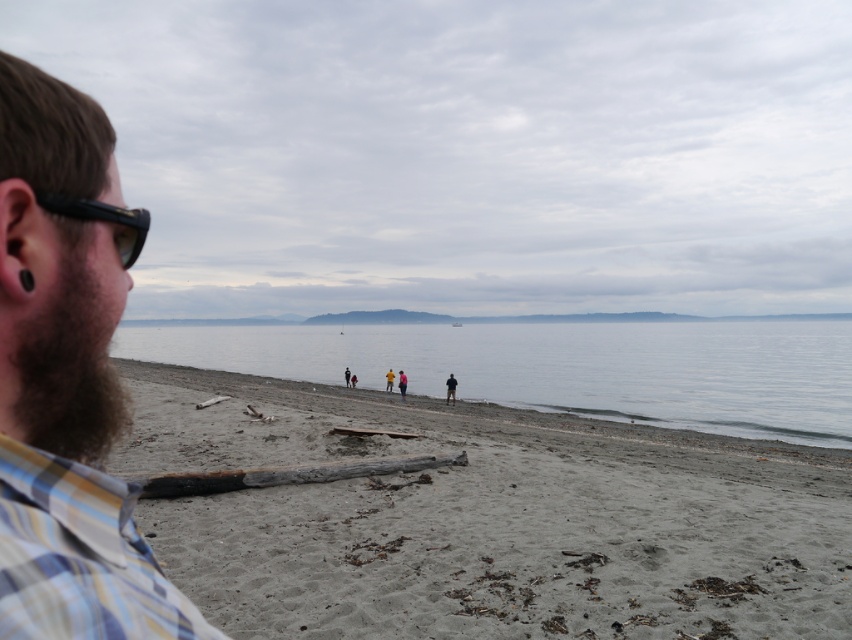
In the scene shown: Who is positioned more to the left, gray sandy beach at center or clear water at center?

gray sandy beach at center is more to the left.

Does point (602, 429) come behind point (749, 381)?

That is False.

Does point (304, 492) lie in front of point (752, 392)?

Yes, it is in front of point (752, 392).

This screenshot has height=640, width=852. I want to click on gray sandy beach at center, so click(x=482, y=518).

Does point (697, 344) lie in front of point (400, 381)?

No.

Is point (629, 332) positioned after point (398, 384)?

Yes.

This screenshot has height=640, width=852. In order to click on clear water at center in this screenshot , I will do (562, 365).

Does gray sandy beach at center have a smaller size compared to pink fabric person at center?

Actually, gray sandy beach at center might be larger than pink fabric person at center.

What do you see at coordinates (482, 518) in the screenshot?
I see `gray sandy beach at center` at bounding box center [482, 518].

Where is `gray sandy beach at center`? This screenshot has height=640, width=852. gray sandy beach at center is located at coordinates (482, 518).